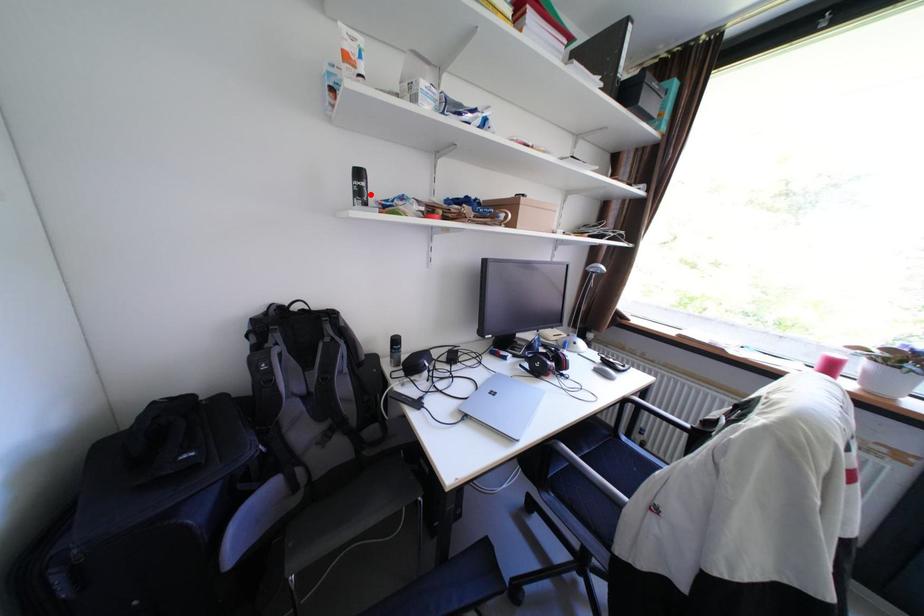
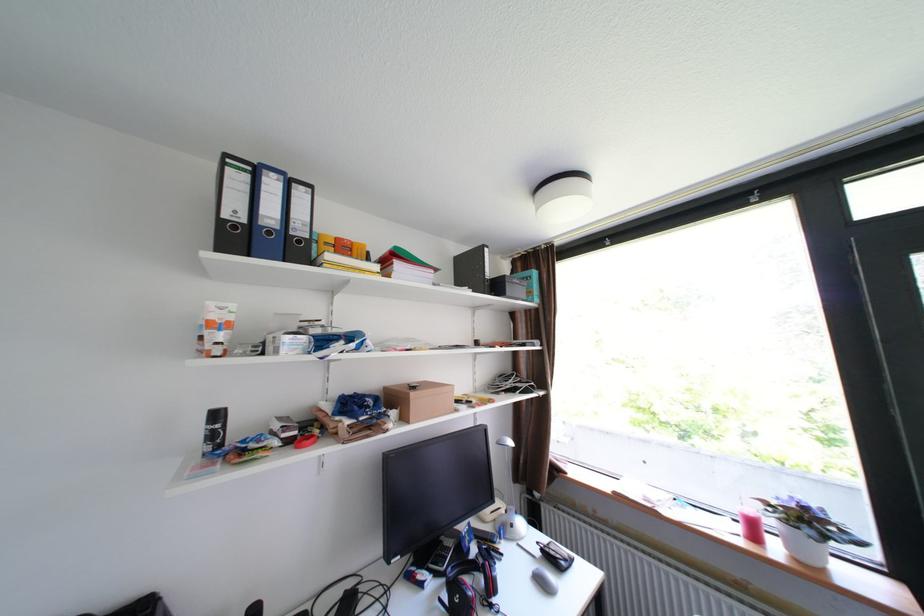
Locate, in the second image, the point that corresponds to the highlighted location in the first image.

(225, 436)